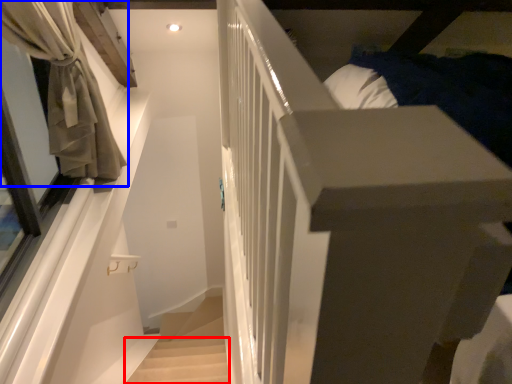
Question: Which object is further to the camera taking this photo, stairwell (highlighted by a red box) or curtain (highlighted by a blue box)?

Choices:
 (A) stairwell
 (B) curtain

Answer: (A)